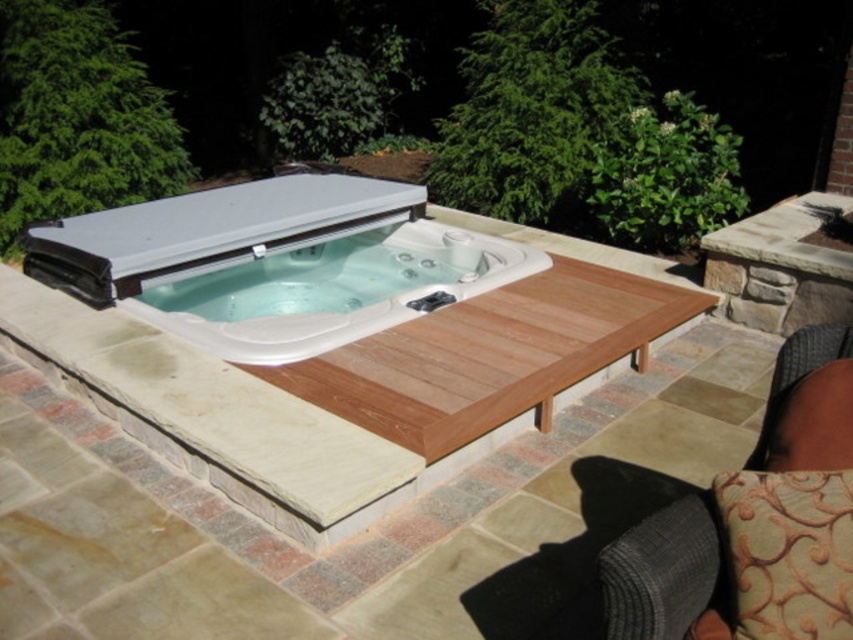
Question: Does brown wood deck at center appear on the left side of teak wood deck at center?

Choices:
 (A) yes
 (B) no

Answer: (A)

Question: Among these objects, which one is farthest from the camera?

Choices:
 (A) teak wood deck at center
 (B) dark gray fabric armchair at lower right
 (C) white glossy hot tub at center
 (D) brown wood deck at center

Answer: (C)

Question: Which point is farther from the camera taking this photo?

Choices:
 (A) (554, 284)
 (B) (343, 240)
 (C) (784, 342)

Answer: (B)

Question: Can you confirm if brown wood deck at center is positioned below teak wood deck at center?

Choices:
 (A) yes
 (B) no

Answer: (B)

Question: Which object appears closest to the camera in this image?

Choices:
 (A) brown wood deck at center
 (B) teak wood deck at center
 (C) dark gray fabric armchair at lower right
 (D) white glossy hot tub at center

Answer: (C)

Question: Observing the image, what is the correct spatial positioning of teak wood deck at center in reference to dark gray fabric armchair at lower right?

Choices:
 (A) right
 (B) left

Answer: (B)